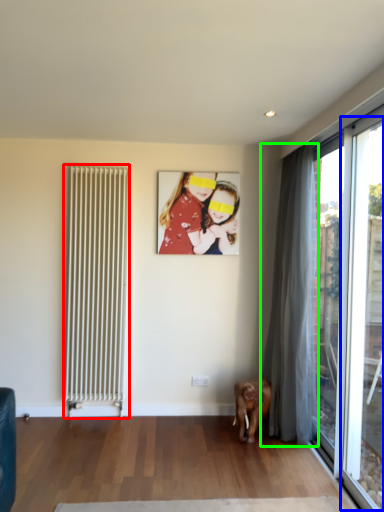
Question: Which object is the farthest from radiator (highlighted by a red box)? Choose among these: window (highlighted by a blue box) or curtain (highlighted by a green box).

Choices:
 (A) window
 (B) curtain

Answer: (A)